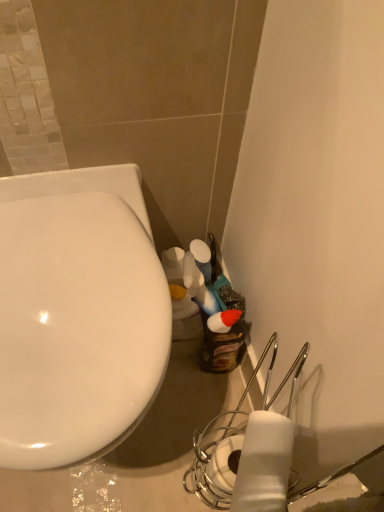
Describe the element at coordinates (77, 314) in the screenshot. I see `white glossy toilet at left` at that location.

Identify the location of white glossy toilet at left. [77, 314].

Image resolution: width=384 pixels, height=512 pixels. I want to click on white matte toilet paper at lower right, so click(264, 464).

What do you see at coordinates (264, 464) in the screenshot? The image size is (384, 512). I see `white matte toilet paper at lower right` at bounding box center [264, 464].

You are a GUI agent. You are given a task and a screenshot of the screen. Output one action in this format:
    pyautogui.click(x=<x>, y=<y>)
    Task: Click on the white glossy toilet at left
    This screenshot has width=384, height=512.
    Given the screenshot: What is the action you would take?
    pyautogui.click(x=77, y=314)

Can you confirm if white glossy toilet at left is positioned to the left of white matte toilet paper at lower right?

Indeed, white glossy toilet at left is positioned on the left side of white matte toilet paper at lower right.

Relative to white matte toilet paper at lower right, is white glossy toilet at left in front or behind?

Visually, white glossy toilet at left is located behind white matte toilet paper at lower right.

Considering the positions of points (151, 333) and (273, 476), is point (151, 333) farther from camera compared to point (273, 476)?

Yes, it is behind point (273, 476).

From the image's perspective, relative to white matte toilet paper at lower right, is white glossy toilet at left above or below?

white glossy toilet at left is above white matte toilet paper at lower right.

From a real-world perspective, is white glossy toilet at left positioned above or below white matte toilet paper at lower right?

In terms of real-world spatial position, white glossy toilet at left is below white matte toilet paper at lower right.

Which object is wider, white glossy toilet at left or white matte toilet paper at lower right?

white glossy toilet at left.

From their relative heights in the image, would you say white glossy toilet at left is taller or shorter than white matte toilet paper at lower right?

In the image, white glossy toilet at left appears to be taller than white matte toilet paper at lower right.

Consider the image. Can you confirm if white glossy toilet at left is smaller than white matte toilet paper at lower right?

Incorrect, white glossy toilet at left is not smaller in size than white matte toilet paper at lower right.

Is white glossy toilet at left located outside white matte toilet paper at lower right?

That's correct, white glossy toilet at left is outside of white matte toilet paper at lower right.

Is there a large distance between white glossy toilet at left and white matte toilet paper at lower right?

No.

Is white glossy toilet at left turned away from white matte toilet paper at lower right?

No, white matte toilet paper at lower right is not at the back of white glossy toilet at left.

Can you tell me how much white glossy toilet at left and white matte toilet paper at lower right differ in facing direction?

The angle between the facing direction of white glossy toilet at left and the facing direction of white matte toilet paper at lower right is 117 degrees.

Where is `toilet on the left of white matte toilet paper at lower right`? The image size is (384, 512). toilet on the left of white matte toilet paper at lower right is located at coordinates (77, 314).

Is white matte toilet paper at lower right to the left or to the right of white glossy toilet at left in the image?

Based on their positions, white matte toilet paper at lower right is located to the right of white glossy toilet at left.

Who is more distant, white matte toilet paper at lower right or white glossy toilet at left?

white glossy toilet at left is behind.

Which is closer to the camera, (285, 467) or (25, 247)?

Clearly, point (285, 467) is closer to the camera than point (25, 247).

From the image's perspective, is white matte toilet paper at lower right under white glossy toilet at left?

Indeed, from the image's perspective, white matte toilet paper at lower right is shown beneath white glossy toilet at left.

From a real-world perspective, which is physically below, white matte toilet paper at lower right or white glossy toilet at left?

From a 3D spatial view, white glossy toilet at left is below.

Between white matte toilet paper at lower right and white glossy toilet at left, which one has larger width?

white glossy toilet at left.

Who is shorter, white matte toilet paper at lower right or white glossy toilet at left?

white matte toilet paper at lower right.

Considering the relative sizes of white matte toilet paper at lower right and white glossy toilet at left in the image provided, is white matte toilet paper at lower right smaller than white glossy toilet at left?

Indeed, white matte toilet paper at lower right has a smaller size compared to white glossy toilet at left.

Is white matte toilet paper at lower right situated inside white glossy toilet at left or outside?

white matte toilet paper at lower right is not inside white glossy toilet at left, it's outside.

Is white matte toilet paper at lower right far away from white glossy toilet at left?

That's not correct — white matte toilet paper at lower right is a little close to white glossy toilet at left.

Could you tell me if white matte toilet paper at lower right is facing white glossy toilet at left?

Yes, white matte toilet paper at lower right faces towards white glossy toilet at left.

What's the angular difference between white matte toilet paper at lower right and white glossy toilet at left's facing directions?

white matte toilet paper at lower right and white glossy toilet at left are facing 117 degrees away from each other.

The width and height of the screenshot is (384, 512). I want to click on toilet paper that appears in front of the white glossy toilet at left, so click(x=264, y=464).

I want to click on toilet paper in front of the white glossy toilet at left, so click(264, 464).

The width and height of the screenshot is (384, 512). What are the coordinates of `toilet paper on the right of white glossy toilet at left` in the screenshot? It's located at (264, 464).